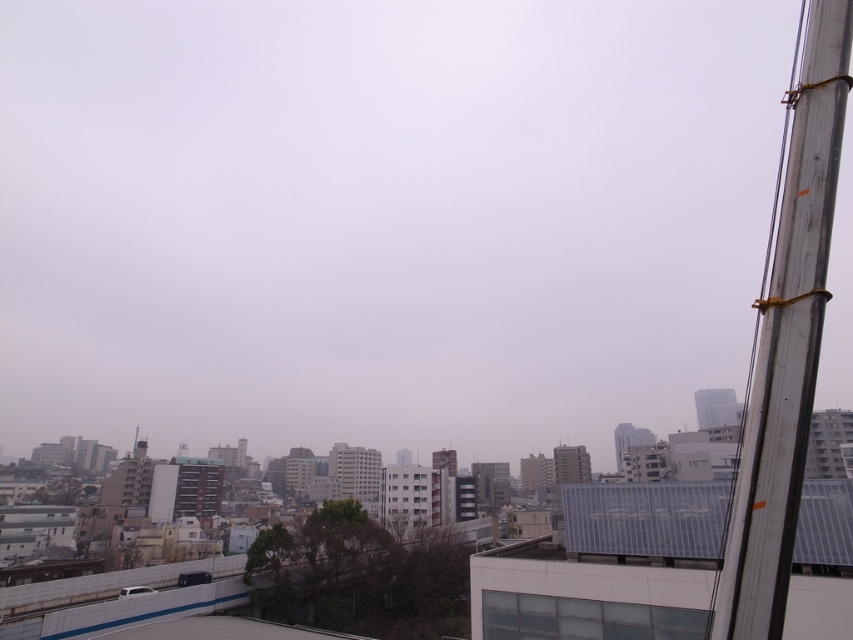
The width and height of the screenshot is (853, 640). What are the coordinates of `metallic gray pole at right` in the screenshot? It's located at (786, 342).

Is metallic gray pole at right shorter than transparent glass window at lower center?

In fact, metallic gray pole at right may be taller than transparent glass window at lower center.

Is point (821, 49) less distant than point (677, 616)?

Yes, point (821, 49) is closer to viewer.

Find the location of a particular element. metallic gray pole at right is located at coordinates (786, 342).